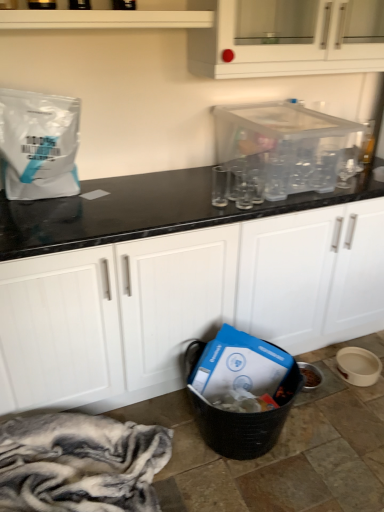
You are a GUI agent. You are given a task and a screenshot of the screen. Output one action in this format:
    pyautogui.click(x=<x>, y=<y>)
    Task: Click on the vacant area to the left of transparent plastic container at upper center
    This screenshot has height=512, width=384.
    Given the screenshot: What is the action you would take?
    pyautogui.click(x=154, y=194)